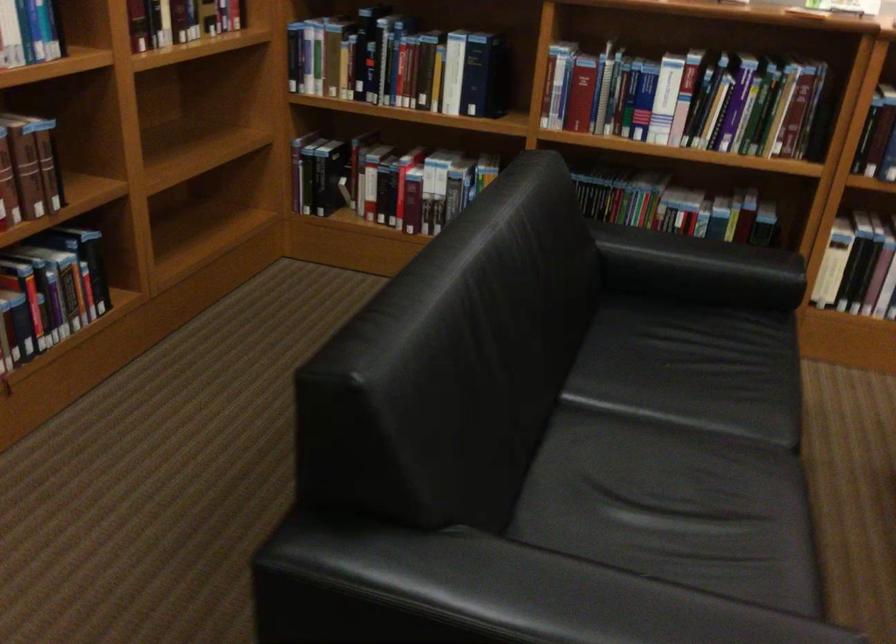
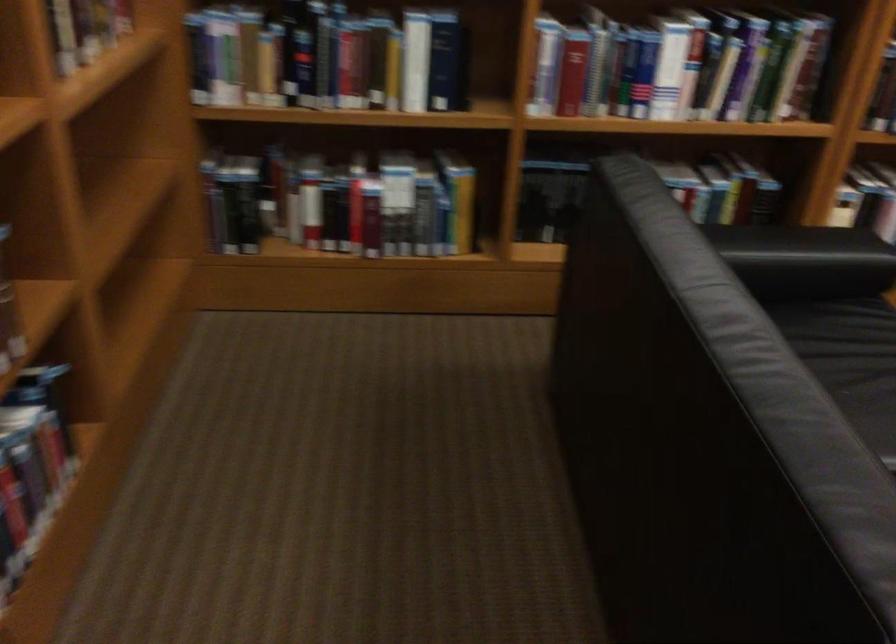
Question: The camera is either moving clockwise (left) or counter-clockwise (right) around the object. The first image is from the beginning of the video and the second image is from the end. Is the camera moving left or right when shooting the video?

Choices:
 (A) Left
 (B) Right

Answer: (A)